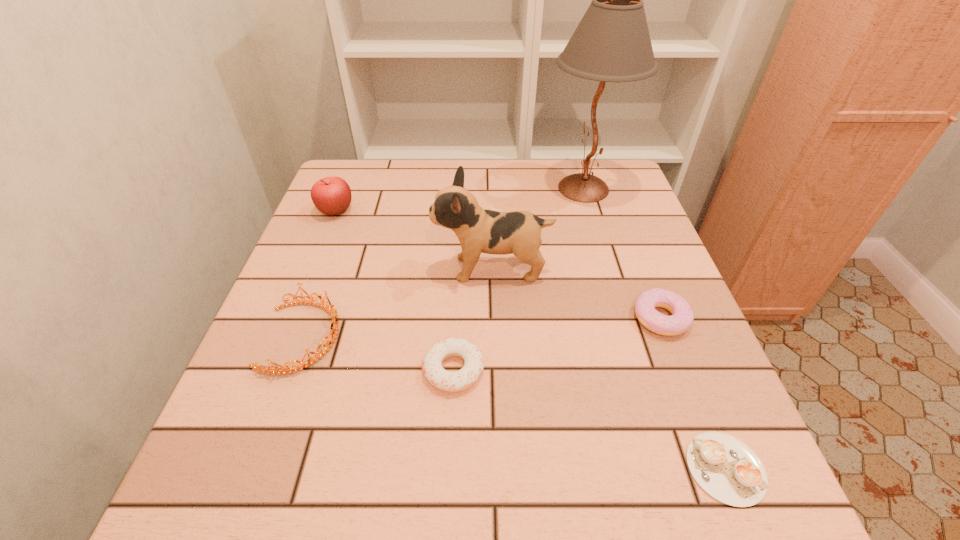
Find the location of a particular element. This screenshot has height=540, width=960. unoccupied position between the fourth shortest object and the right doughnut is located at coordinates (482, 327).

Find the location of a particular element. The width and height of the screenshot is (960, 540). vacant point located between the second tallest object and the right doughnut is located at coordinates (576, 293).

The height and width of the screenshot is (540, 960). Find the location of `free space between the fifth shortest object and the fourth shortest object`. free space between the fifth shortest object and the fourth shortest object is located at coordinates (320, 274).

Image resolution: width=960 pixels, height=540 pixels. What are the coordinates of `vacant region between the table lamp and the farther doughnut` in the screenshot? It's located at 622,253.

The width and height of the screenshot is (960, 540). Identify the location of vacant area that lies between the tallest object and the right doughnut. (622, 253).

This screenshot has height=540, width=960. What are the coordinates of `empty space between the cappuccino and the right doughnut` in the screenshot? It's located at (693, 393).

Point out which object is positioned as the fourth nearest to the nearer doughnut. Please provide its 2D coordinates. Your answer should be formatted as a tuple, i.e. [(x, y)], where the tuple contains the x and y coordinates of a point satisfying the conditions above.

[(727, 469)]

You are a GUI agent. You are given a task and a screenshot of the screen. Output one action in this format:
    pyautogui.click(x=<x>, y=<y>)
    Task: Click on the object that stands as the third closest to the cappuccino
    This screenshot has width=960, height=540.
    Given the screenshot: What is the action you would take?
    pyautogui.click(x=479, y=230)

Where is `free spot that satisfies the following two spatial constraints: 1. at the face of the sixth shortest object; 2. on the back side of the cappuccino`? free spot that satisfies the following two spatial constraints: 1. at the face of the sixth shortest object; 2. on the back side of the cappuccino is located at coordinates (497, 468).

You are a GUI agent. You are given a task and a screenshot of the screen. Output one action in this format:
    pyautogui.click(x=<x>, y=<y>)
    Task: Click on the free space that satisfies the following two spatial constraints: 1. at the face of the right doughnut; 2. on the left side of the second tallest object
    
    Given the screenshot: What is the action you would take?
    pyautogui.click(x=493, y=318)